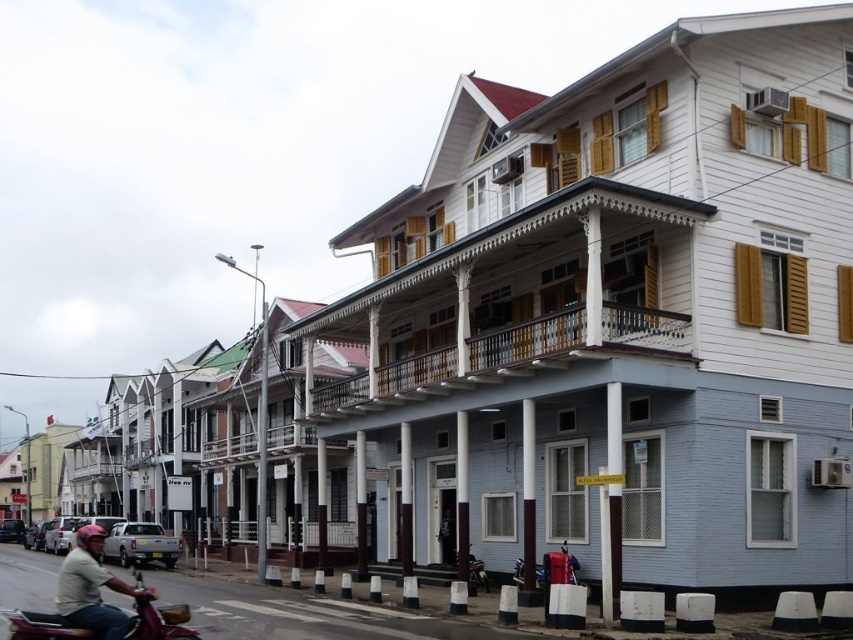
You are a delivery person who needs to park your metallic maroon motorcycle at lower left near the camera for a quick photo. Given that the distance between them is 20.91 meters, can you safely walk from the motorcycle to the camera without crossing any lanes?

The metallic maroon motorcycle at lower left and camera are 20.91 meters apart. Since the road is marked with white lines indicating traffic lanes, you should walk along the sidewalk or designated pedestrian paths to reach the camera safely without crossing lanes.

You are a delivery person who needs to load a package onto the metallic maroon motorcycle at lower left. The package requires that its height must not exceed the height of the light brown leather helmet at lower left. Can you safely load the package onto the motorcycle without exceeding the height limit?

The metallic maroon motorcycle at lower left is shorter than the light brown leather leather helmet at lower left. Therefore, the package must not exceed the height of the helmet, but since the motorcycle itself is shorter than the helmet, the package height must be adjusted to fit within the motorcycle height, which is lower than the helmet. This means the package can be safely loaded as long as it doesn